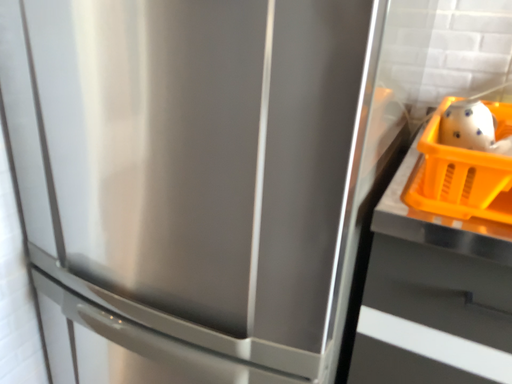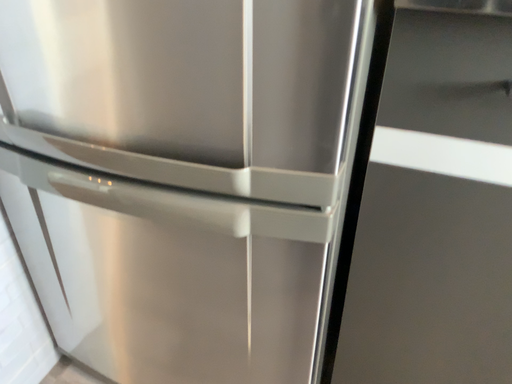
Question: How did the camera likely rotate when shooting the video?

Choices:
 (A) rotated upward
 (B) rotated downward

Answer: (B)